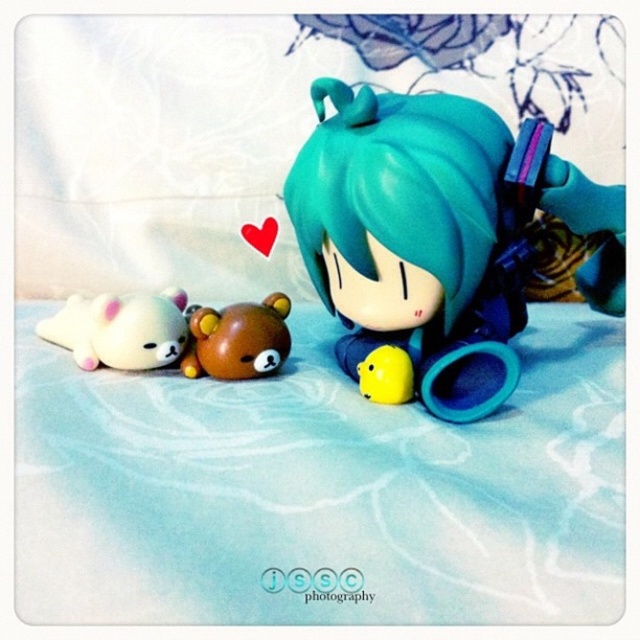
Does brown plush bear at center appear on the right side of yellow matte plush at center?

No, brown plush bear at center is not to the right of yellow matte plush at center.

Can you confirm if brown plush bear at center is thinner than yellow matte plush at center?

Incorrect, brown plush bear at center's width is not less than yellow matte plush at center's.

Which is behind, point (220, 326) or point (378, 353)?

Positioned behind is point (220, 326).

I want to click on brown plush bear at center, so click(237, 339).

Is point (188, 310) farther from camera compared to point (227, 332)?

That is True.

What are the coordinates of `white plush at left` in the screenshot? It's located at (122, 330).

Between point (134, 307) and point (364, 390), which one is positioned behind?

Point (134, 307)

Does white plush at left appear on the right side of yellow matte plush at center?

In fact, white plush at left is to the left of yellow matte plush at center.

Does point (136, 321) come farther from viewer compared to point (381, 358)?

That is True.

Identify the location of white plush at left. (122, 330).